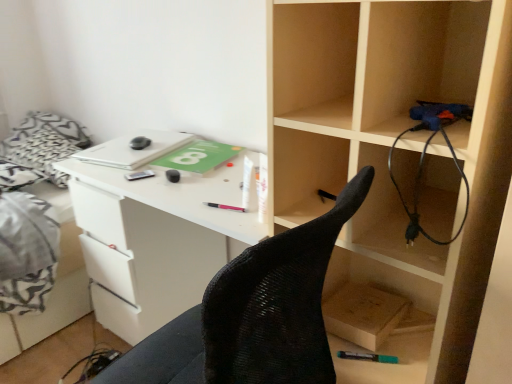
Locate an element on the screen. vacant area situated to the left side of pink plastic pen at center, acting as the 2th stationery starting from the bottom is located at coordinates (181, 201).